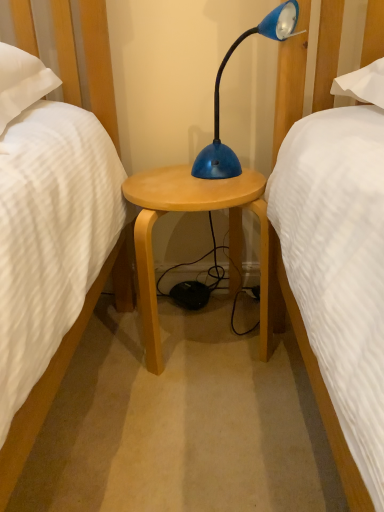
Question: Does point (122, 187) appear closer or farther from the camera than point (216, 159)?

Choices:
 (A) farther
 (B) closer

Answer: (B)

Question: From the image's perspective, relative to blue glossy desk lamp at center, is light wood stool at center above or below?

Choices:
 (A) above
 (B) below

Answer: (B)

Question: Choose the correct answer: Is light wood stool at center inside blue glossy desk lamp at center or outside it?

Choices:
 (A) inside
 (B) outside

Answer: (B)

Question: Is point (223, 56) positioned closer to the camera than point (147, 305)?

Choices:
 (A) closer
 (B) farther

Answer: (B)

Question: In the image, is blue glossy desk lamp at center on the left side or the right side of light wood stool at center?

Choices:
 (A) left
 (B) right

Answer: (B)

Question: Is blue glossy desk lamp at center wider or thinner than light wood stool at center?

Choices:
 (A) wide
 (B) thin

Answer: (B)

Question: In the image, is blue glossy desk lamp at center positioned in front of or behind light wood stool at center?

Choices:
 (A) behind
 (B) front

Answer: (B)